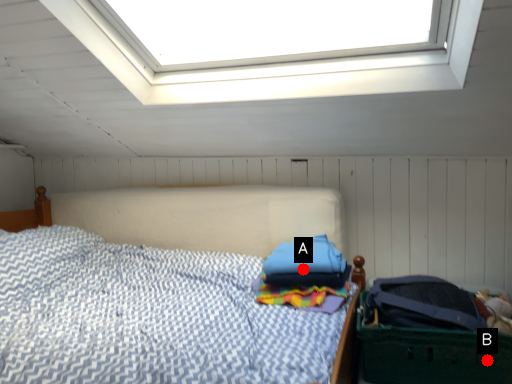
Question: Two points are circled on the image, labeled by A and B beside each circle. Which point is closer to the camera?

Choices:
 (A) A is closer
 (B) B is closer

Answer: (B)